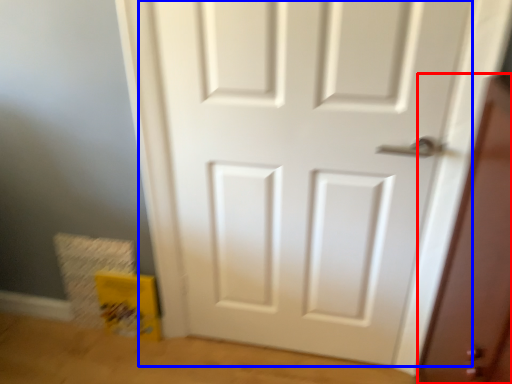
Question: Which object is further to the camera taking this photo, screen door (highlighted by a red box) or door (highlighted by a blue box)?

Choices:
 (A) screen door
 (B) door

Answer: (B)